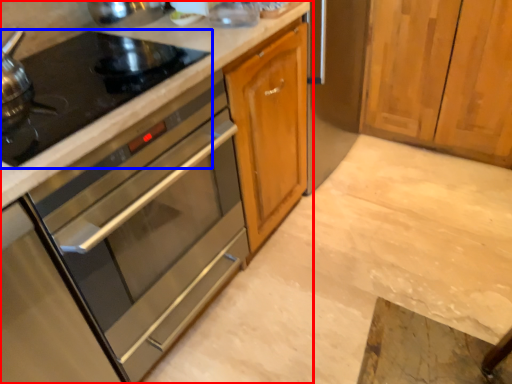
Question: Which object appears closest to the camera in this image, cabinetry (highlighted by a red box) or gas stove (highlighted by a blue box)?

Choices:
 (A) cabinetry
 (B) gas stove

Answer: (A)